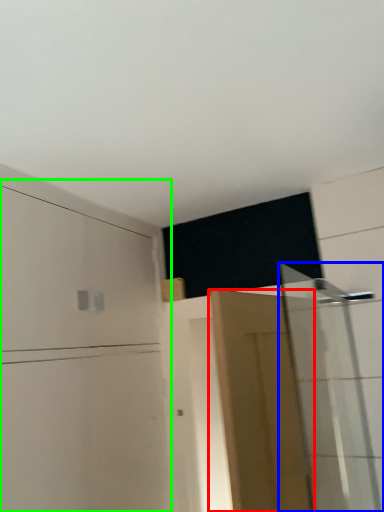
Question: Considering the real-world distances, which object is farthest from door (highlighted by a red box)? shower door (highlighted by a blue box) or dresser (highlighted by a green box)?

Choices:
 (A) shower door
 (B) dresser

Answer: (B)